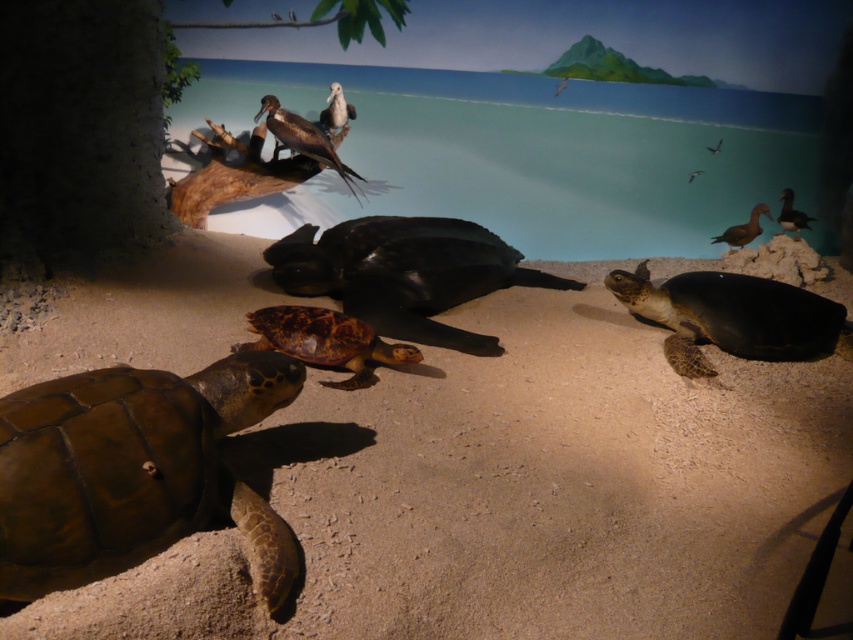
Is brown matte tortoise at lower left wider than brown matte/tough shell at center?

No, brown matte tortoise at lower left is not wider than brown matte/tough shell at center.

Measure the distance between brown matte tortoise at lower left and brown matte/tough shell at center.

They are 3.33 feet apart.

Between point (260, 536) and point (312, 312), which one is positioned in front?

Point (260, 536) is in front.

Where is `brown matte tortoise at lower left`? Image resolution: width=853 pixels, height=640 pixels. brown matte tortoise at lower left is located at coordinates (132, 470).

Does brown matte tortoise at lower left have a greater height compared to shiny black tortoise at center?

Incorrect, brown matte tortoise at lower left's height is not larger of shiny black tortoise at center's.

Who is taller, brown matte tortoise at lower left or shiny black tortoise at center?

With more height is shiny black tortoise at center.

Where is `brown matte tortoise at lower left`? The height and width of the screenshot is (640, 853). brown matte tortoise at lower left is located at coordinates (132, 470).

Does brown matte/tough shell at center have a greater height compared to smooth dark green tortoise at right?

Yes, brown matte/tough shell at center is taller than smooth dark green tortoise at right.

Is brown matte/tough shell at center to the right of smooth dark green tortoise at right from the viewer's perspective?

No, brown matte/tough shell at center is not to the right of smooth dark green tortoise at right.

Which is behind, point (303, 316) or point (802, 218)?

The point (802, 218) is more distant.

Where is `brown matte/tough shell at center`? brown matte/tough shell at center is located at coordinates (323, 340).